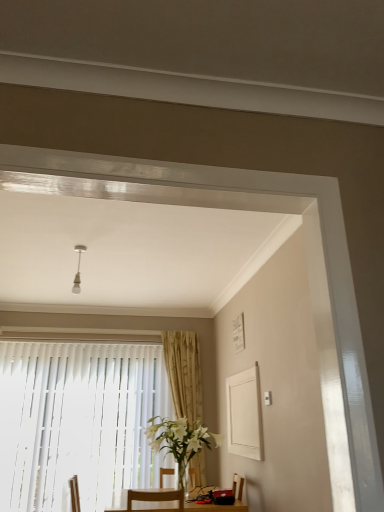
Where is `white glass vase at center`? The height and width of the screenshot is (512, 384). white glass vase at center is located at coordinates (180, 441).

You are a GUI agent. You are given a task and a screenshot of the screen. Output one action in this format:
    pyautogui.click(x=<x>, y=<y>)
    Task: Click on the white vertical blinds at lower left
    The width and height of the screenshot is (384, 512).
    Given the screenshot: What is the action you would take?
    pyautogui.click(x=78, y=422)

This screenshot has height=512, width=384. In order to click on curtain located above the white glass vase at center (from a real-world perspective) in this screenshot , I will do `click(184, 374)`.

Is gold textured curtain at center at the left side of white glass vase at center?

Indeed, gold textured curtain at center is positioned on the left side of white glass vase at center.

Is gold textured curtain at center behind white glass vase at center?

Yes, gold textured curtain at center is further from the viewer.

Is gold textured curtain at center oriented away from white vertical blinds at lower left?

No, gold textured curtain at center's orientation is not away from white vertical blinds at lower left.

Consider the image. Considering the sizes of gold textured curtain at center and white vertical blinds at lower left in the image, is gold textured curtain at center bigger or smaller than white vertical blinds at lower left?

gold textured curtain at center is smaller than white vertical blinds at lower left.

Is gold textured curtain at center not inside white vertical blinds at lower left?

Absolutely, gold textured curtain at center is external to white vertical blinds at lower left.

Based on the photo, from the image's perspective, which object appears higher, gold textured curtain at center or white vertical blinds at lower left?

gold textured curtain at center, from the image's perspective.

From a real-world perspective, does white glass vase at center stand above white vertical blinds at lower left?

Incorrect, from a real-world perspective, white glass vase at center is lower than white vertical blinds at lower left.

From their relative heights in the image, would you say white glass vase at center is taller or shorter than white vertical blinds at lower left?

Clearly, white glass vase at center is shorter compared to white vertical blinds at lower left.

In the scene shown: Which object is positioned more to the left, white glass vase at center or white vertical blinds at lower left?

From the viewer's perspective, white vertical blinds at lower left appears more on the left side.

Is white glass vase at center oriented away from white vertical blinds at lower left?

No.

Is white vertical blinds at lower left touching gold textured curtain at center?

No, white vertical blinds at lower left is not making contact with gold textured curtain at center.

Is white vertical blinds at lower left looking in the opposite direction of gold textured curtain at center?

white vertical blinds at lower left is not turned away from gold textured curtain at center.

Does point (110, 356) come closer to viewer compared to point (189, 347)?

Yes, point (110, 356) is closer to viewer.

Does white vertical blinds at lower left have a smaller size compared to gold textured curtain at center?

No, white vertical blinds at lower left is not smaller than gold textured curtain at center.

Can you tell me how much white vertical blinds at lower left and white glass vase at center differ in facing direction?

The angular difference between white vertical blinds at lower left and white glass vase at center is 90.9 degrees.

Between white vertical blinds at lower left and white glass vase at center, which one is positioned in front?

Positioned in front is white glass vase at center.

In the scene shown: Can you confirm if white vertical blinds at lower left is thinner than white glass vase at center?

Yes, white vertical blinds at lower left is thinner than white glass vase at center.

Is point (104, 485) positioned in front of point (218, 438)?

Yes, it is.

Is white glass vase at center facing away from gold textured curtain at center?

No, white glass vase at center is not facing the opposite direction of gold textured curtain at center.

Looking at this image, is white glass vase at center outside of gold textured curtain at center?

Yes, white glass vase at center is outside of gold textured curtain at center.

At what (x,y) coordinates should I click in order to perform the action: click on curtain located above the white glass vase at center (from the image's perspective). Please return your answer as a coordinate pair (x, y). This screenshot has height=512, width=384. Looking at the image, I should click on (184, 374).

The width and height of the screenshot is (384, 512). Identify the location of curtain above the white glass vase at center (from the image's perspective). (184, 374).

Locate an element on the screen. The width and height of the screenshot is (384, 512). window that is on the left side of gold textured curtain at center is located at coordinates (78, 422).

From the image, which object appears to be farther from white glass vase at center, white vertical blinds at lower left or gold textured curtain at center?

white vertical blinds at lower left is further to white glass vase at center.

Which object lies nearer to the anchor point gold textured curtain at center, white glass vase at center or white vertical blinds at lower left?

Among the two, white vertical blinds at lower left is located nearer to gold textured curtain at center.

Considering their positions, is white vertical blinds at lower left positioned further to gold textured curtain at center than white glass vase at center?

The object further to gold textured curtain at center is white glass vase at center.

When comparing their distances from white vertical blinds at lower left, does gold textured curtain at center or white glass vase at center seem further?

Among the two, white glass vase at center is located further to white vertical blinds at lower left.

Considering their positions, is white glass vase at center positioned further to white vertical blinds at lower left than gold textured curtain at center?

Among the two, white glass vase at center is located further to white vertical blinds at lower left.

Based on their spatial positions, is gold textured curtain at center or white vertical blinds at lower left further from white glass vase at center?

white vertical blinds at lower left is further to white glass vase at center.

Where is `curtain between white vertical blinds at lower left and white glass vase at center`? The image size is (384, 512). curtain between white vertical blinds at lower left and white glass vase at center is located at coordinates (184, 374).